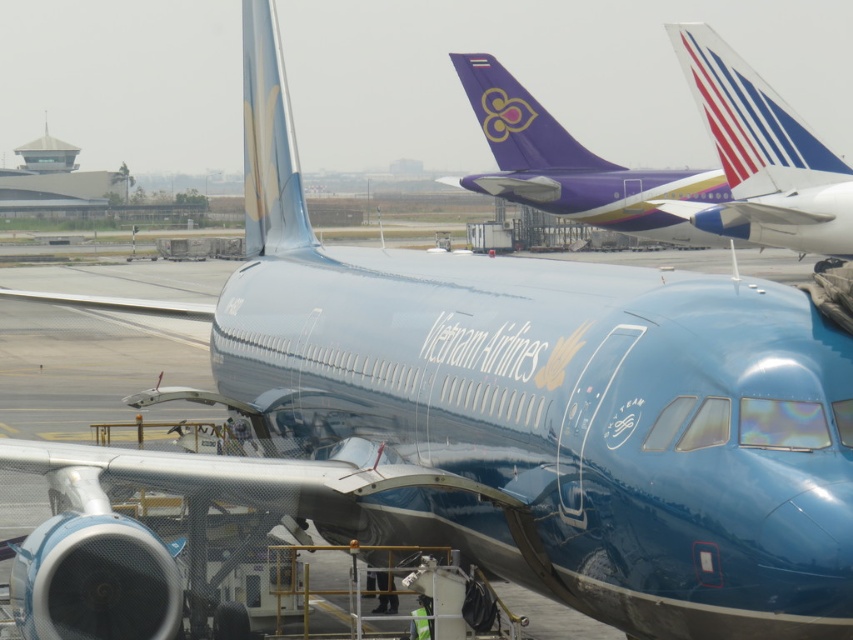
Is the position of blue glossy tail at upper right less distant than that of metallic purple airplane at upper center?

Yes, it is in front of metallic purple airplane at upper center.

Is point (732, 234) closer to camera compared to point (657, 214)?

That is True.

Between point (827, 192) and point (611, 184), which one is positioned in front?

Point (827, 192)

Locate an element on the screen. blue glossy tail at upper right is located at coordinates (761, 156).

In the scene shown: Who is higher up, blue glossy tail at upper right or glossy blue tail at center?

glossy blue tail at center is higher up.

Between point (753, 164) and point (248, 49), which one is positioned behind?

Point (753, 164)

Which is behind, point (849, 209) or point (264, 179)?

The point (849, 209) is more distant.

This screenshot has height=640, width=853. I want to click on blue glossy tail at upper right, so click(761, 156).

Is metallic purple airplane at upper center in front of glossy blue tail at center?

No, metallic purple airplane at upper center is further to the viewer.

Based on the photo, which of these two, metallic purple airplane at upper center or glossy blue tail at center, stands shorter?

Standing shorter between the two is metallic purple airplane at upper center.

What do you see at coordinates (573, 164) in the screenshot? I see `metallic purple airplane at upper center` at bounding box center [573, 164].

Find the location of a particular element. The height and width of the screenshot is (640, 853). metallic purple airplane at upper center is located at coordinates (573, 164).